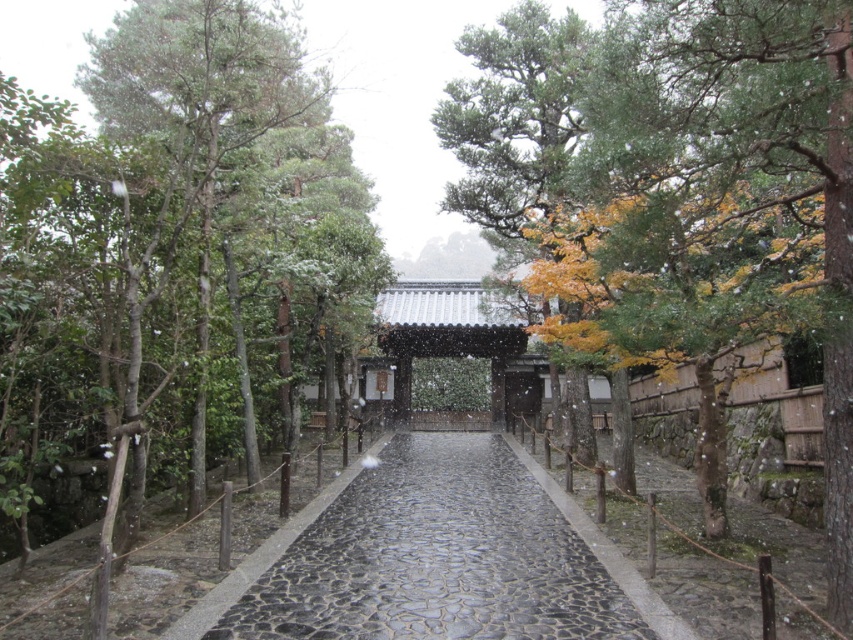
Who is more forward, (x=747, y=93) or (x=436, y=627)?

Point (x=747, y=93) is in front.

Does green textured tree at center have a lesser width compared to black cobblestone path at center?

No, green textured tree at center is not thinner than black cobblestone path at center.

Is point (625, 35) closer to viewer compared to point (323, 602)?

No, (625, 35) is behind (323, 602).

Locate an element on the screen. The image size is (853, 640). green textured tree at center is located at coordinates (732, 179).

Between green leafy tree at left and black cobblestone path at center, which one appears on the right side from the viewer's perspective?

black cobblestone path at center is more to the right.

Is green leafy tree at left positioned before black cobblestone path at center?

Yes, it is in front of black cobblestone path at center.

Does point (106, 84) come behind point (550, 536)?

Yes, it is.

This screenshot has height=640, width=853. In order to click on green leafy tree at left in this screenshot , I will do `click(173, 252)`.

Is the position of green leafy tree at left less distant than that of green textured tree at center?

No.

Can you confirm if green leafy tree at left is bigger than green textured tree at center?

Yes.

Is point (257, 260) in front of point (848, 68)?

No, it is not.

I want to click on green leafy tree at left, so (173, 252).